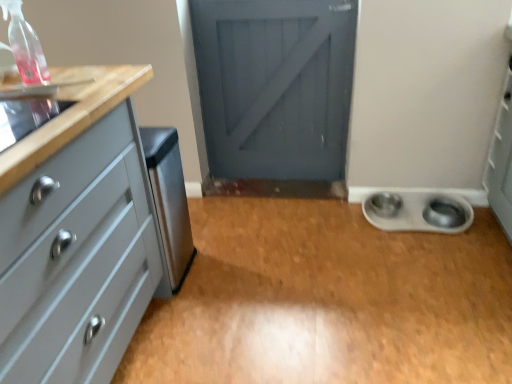
I want to click on free space above metallic silver bowls at lower right (from a real-world perspective), so click(x=314, y=264).